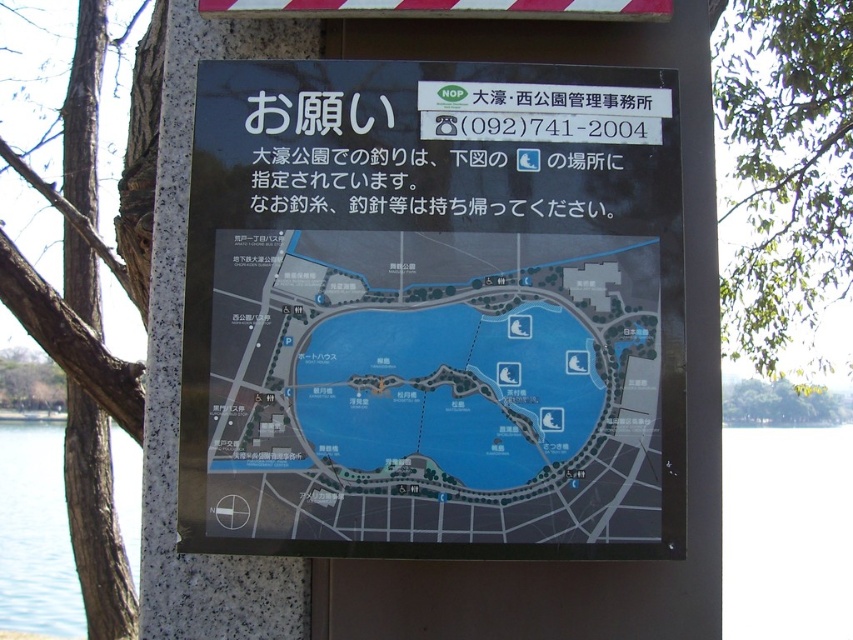
Does blue paper map at center appear on the right side of transparent water at lower left?

Yes, blue paper map at center is to the right of transparent water at lower left.

Who is more forward, (525,500) or (55,474)?

Point (525,500)

The height and width of the screenshot is (640, 853). Identify the location of blue paper map at center. (434, 387).